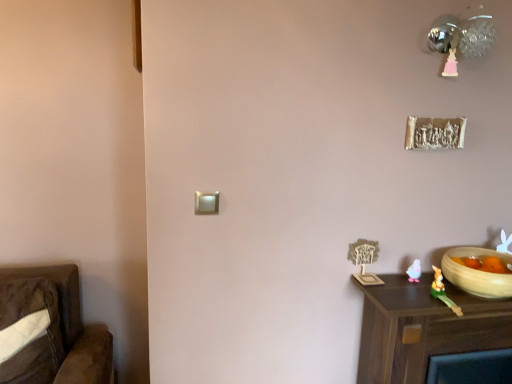
Where is `vacant area to the left of pink plastic toy at lower right, the 2th toy when ordered from front to back`? The height and width of the screenshot is (384, 512). vacant area to the left of pink plastic toy at lower right, the 2th toy when ordered from front to back is located at coordinates (384, 285).